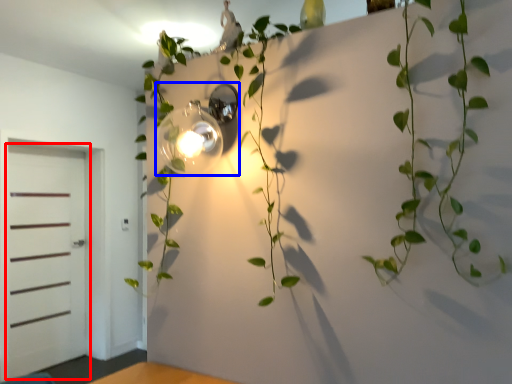
Question: Which point is closer to the camera, door (highlighted by a red box) or light fixture (highlighted by a blue box)?

Choices:
 (A) door
 (B) light fixture

Answer: (B)